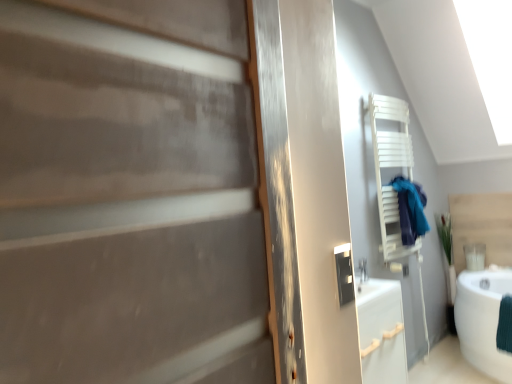
Describe the element at coordinates (410, 209) in the screenshot. I see `blue fabric at right` at that location.

At what (x,y) coordinates should I click in order to perform the action: click on blue fabric at right. Please return your answer as a coordinate pair (x, y). This screenshot has height=384, width=512. Looking at the image, I should click on (410, 209).

What is the approximate height of white glossy bathtub at lower right?

white glossy bathtub at lower right is 24.09 inches tall.

The height and width of the screenshot is (384, 512). What do you see at coordinates (482, 320) in the screenshot? I see `white glossy bathtub at lower right` at bounding box center [482, 320].

Find the location of a particular element. This screenshot has height=384, width=512. white glossy bathtub at lower right is located at coordinates (482, 320).

Identify the location of blue fabric at right. The image size is (512, 384). (410, 209).

Considering the relative positions of white glossy bathtub at lower right and blue fabric at right in the image provided, is white glossy bathtub at lower right to the right of blue fabric at right from the viewer's perspective?

Indeed, white glossy bathtub at lower right is positioned on the right side of blue fabric at right.

Considering the positions of objects white glossy bathtub at lower right and blue fabric at right in the image provided, who is behind, white glossy bathtub at lower right or blue fabric at right?

blue fabric at right is further from the camera.

Which is farther, (x=473, y=307) or (x=409, y=183)?

Positioned behind is point (x=473, y=307).

From the image's perspective, which one is positioned higher, white glossy bathtub at lower right or blue fabric at right?

blue fabric at right, from the image's perspective.

In the scene shown: From a real-world perspective, is white glossy bathtub at lower right located beneath blue fabric at right?

Correct, in the physical world, white glossy bathtub at lower right is lower than blue fabric at right.

Does white glossy bathtub at lower right have a greater width compared to blue fabric at right?

Correct, the width of white glossy bathtub at lower right exceeds that of blue fabric at right.

Looking at this image, from their relative heights in the image, would you say white glossy bathtub at lower right is taller or shorter than blue fabric at right?

In the image, white glossy bathtub at lower right appears to be taller than blue fabric at right.

Which of these two, white glossy bathtub at lower right or blue fabric at right, is smaller?

With smaller size is blue fabric at right.

Consider the image. Is blue fabric at right located within white glossy bathtub at lower right?

No, white glossy bathtub at lower right does not contain blue fabric at right.

Would you say white glossy bathtub at lower right is a long distance from blue fabric at right?

No, white glossy bathtub at lower right is in close proximity to blue fabric at right.

Could you tell me if white glossy bathtub at lower right is facing blue fabric at right?

No, white glossy bathtub at lower right is not aimed at blue fabric at right.

How different are the orientations of white glossy bathtub at lower right and blue fabric at right in degrees?

The angle between the facing direction of white glossy bathtub at lower right and the facing direction of blue fabric at right is 90.2 degrees.

Locate an element on the screen. This screenshot has height=384, width=512. bath that appears below the blue fabric at right (from the image's perspective) is located at coordinates (482, 320).

Considering the relative positions of blue fabric at right and white glossy bathtub at lower right in the image provided, is blue fabric at right to the left of white glossy bathtub at lower right from the viewer's perspective?

Yes, blue fabric at right is to the left of white glossy bathtub at lower right.

Which object is more forward, blue fabric at right or white glossy bathtub at lower right?

white glossy bathtub at lower right is closer to the camera.

Which point is more forward, (413, 184) or (464, 355)?

Point (413, 184)

From the image's perspective, is blue fabric at right positioned above or below white glossy bathtub at lower right?

Based on their image positions, blue fabric at right is located above white glossy bathtub at lower right.

From a real-world perspective, is blue fabric at right over white glossy bathtub at lower right?

Correct, in the physical world, blue fabric at right is higher than white glossy bathtub at lower right.

Considering the relative sizes of blue fabric at right and white glossy bathtub at lower right in the image provided, is blue fabric at right thinner than white glossy bathtub at lower right?

Yes, blue fabric at right is thinner than white glossy bathtub at lower right.

Between blue fabric at right and white glossy bathtub at lower right, which one has less height?

blue fabric at right is shorter.

Does blue fabric at right have a smaller size compared to white glossy bathtub at lower right?

Correct, blue fabric at right occupies less space than white glossy bathtub at lower right.

Can white glossy bathtub at lower right be found inside blue fabric at right?

No, blue fabric at right does not contain white glossy bathtub at lower right.

Is blue fabric at right not near white glossy bathtub at lower right?

Actually, blue fabric at right and white glossy bathtub at lower right are a little close together.

Is blue fabric at right looking in the opposite direction of white glossy bathtub at lower right?

That's not correct — blue fabric at right is not looking away from white glossy bathtub at lower right.

How distant is blue fabric at right from white glossy bathtub at lower right?

A distance of 31.30 inches exists between blue fabric at right and white glossy bathtub at lower right.

Where is `laundry that appears above the white glossy bathtub at lower right (from the image's perspective)`? The image size is (512, 384). laundry that appears above the white glossy bathtub at lower right (from the image's perspective) is located at coordinates (410, 209).

Where is `laundry located above the white glossy bathtub at lower right (from the image's perspective)`? This screenshot has height=384, width=512. laundry located above the white glossy bathtub at lower right (from the image's perspective) is located at coordinates (410, 209).

Find the location of a particular element. The height and width of the screenshot is (384, 512). laundry behind the white glossy bathtub at lower right is located at coordinates (410, 209).